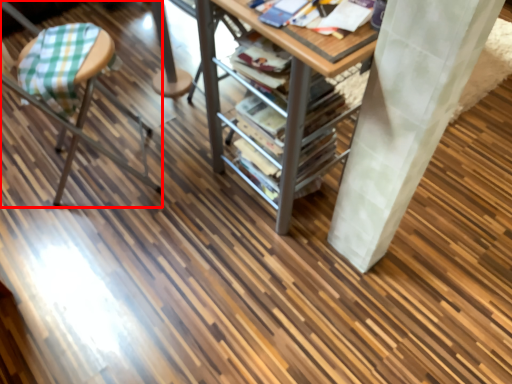
Question: From the image's perspective, considering the relative positions of furniture (annotated by the red box) and table in the image provided, where is furniture (annotated by the red box) located with respect to the staircase?

Choices:
 (A) below
 (B) above

Answer: (A)